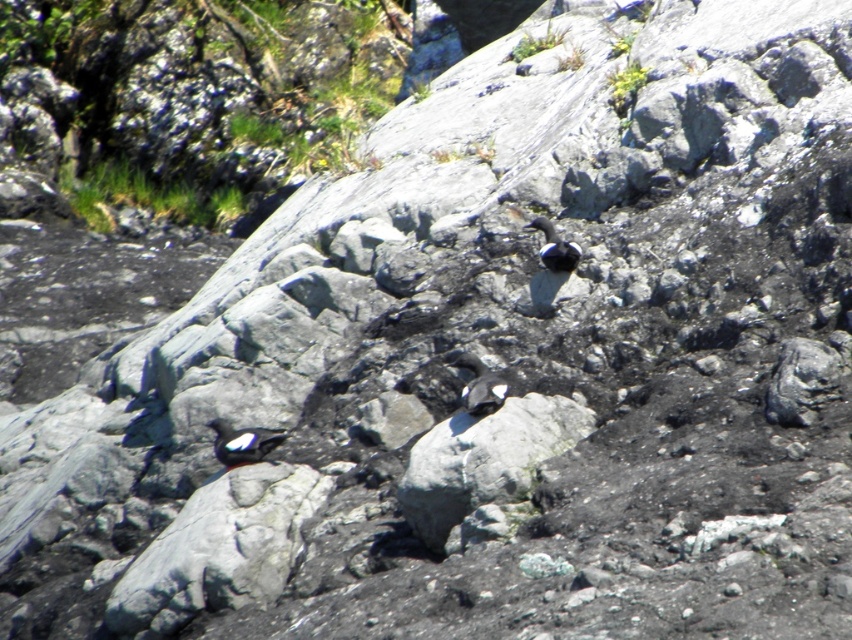
You are a hiker trying to navigate across the rocky terrain. You see a gray rough rock at lower left. Where exactly is this rock located in the image?

The gray rough rock at lower left is located at point (219, 548) in the image.

You are a hiker observing the two birds on the rocky terrain. Which bird is positioned to the left when looking at the white matte bird at center and the black matte bird at center?

The white matte bird at center is positioned to the left of the black matte bird at center.